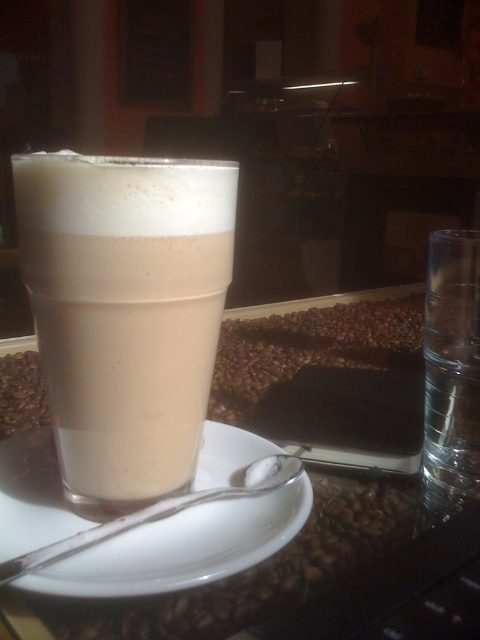
You are a barista trying to clean the glass. You notice a point at coordinates [126,310] in the image. Based on the scene description, what is located at that point?

The point at coordinates [126,310] indicates smooth beige foam at center.

You are looking at the beverage in the image. There are two points marked in the scene. Which point is closer to you, point 1 at coordinates (324, 316) or point 2 at coordinates (140, 522)?

Point 1 at coordinates (324, 316) is closer to you because it is further to the viewer than point 2 at coordinates (140, 522).

You are a barista trying to clean the table after serving the drink. The smooth beige foam at center is currently at position point 0.486, 0.263. If you want to move the glass without spilling the foam, which direction should you move it relative to the current position?

Since the smooth beige foam at center is at point [126,310], you should move the glass in the direction away from that point to avoid spilling the foam.